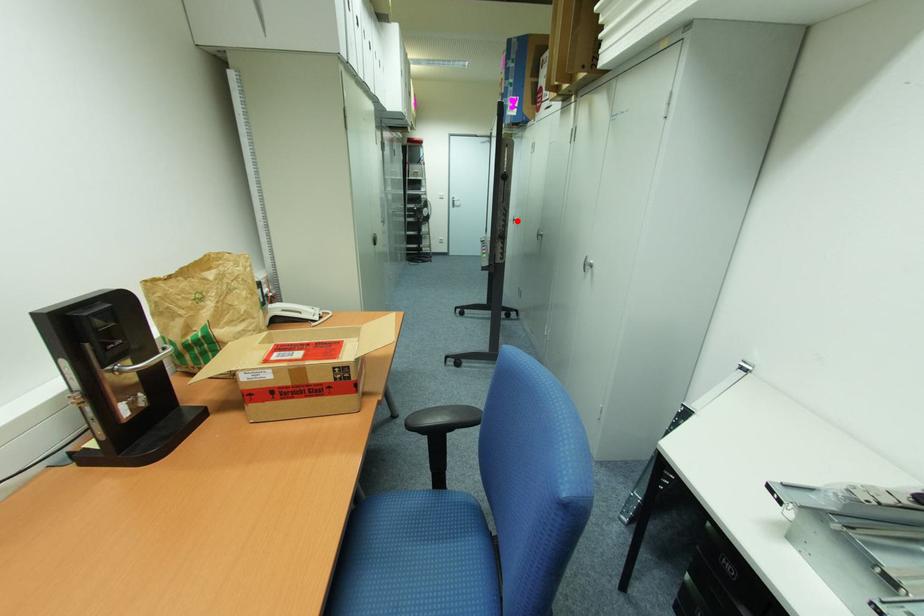
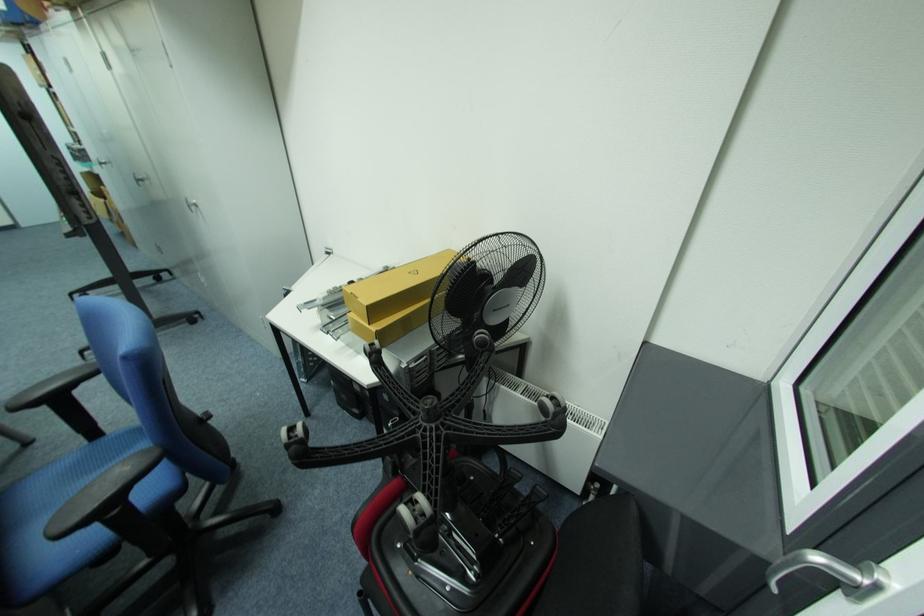
Locate, in the second image, the point that corresponds to the highlighted location in the first image.

(105, 164)